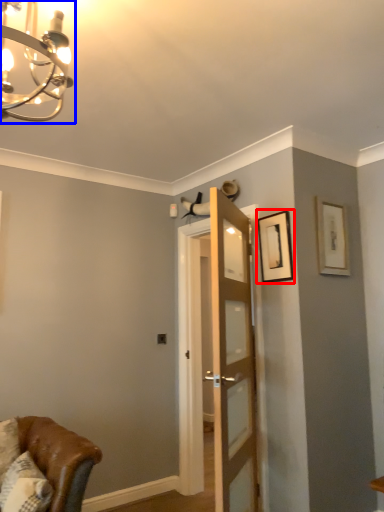
Question: Which of the following is the farthest to the observer, picture frame (highlighted by a red box) or light fixture (highlighted by a blue box)?

Choices:
 (A) picture frame
 (B) light fixture

Answer: (A)